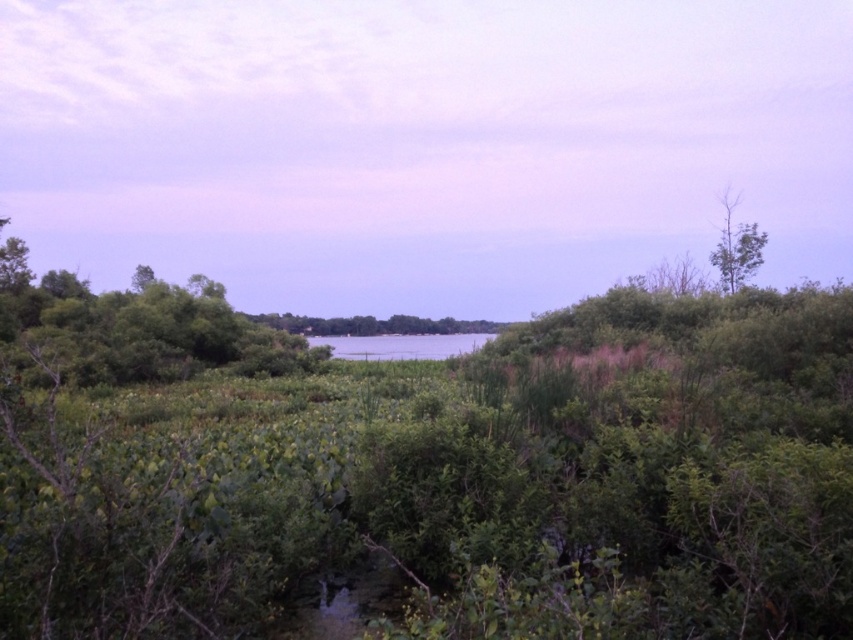
Question: Considering the relative positions of green leafy tree at center and green leafy tree at upper right in the image provided, where is green leafy tree at center located with respect to green leafy tree at upper right?

Choices:
 (A) right
 (B) left

Answer: (B)

Question: Can you confirm if green leafy tree at left is positioned to the left of green leafy tree at center?

Choices:
 (A) yes
 (B) no

Answer: (A)

Question: Can you confirm if green leafy tree at left is wider than green leafy tree at center?

Choices:
 (A) no
 (B) yes

Answer: (A)

Question: Which object is the closest to the green leafy tree at center?

Choices:
 (A) green leafy tree at left
 (B) green leafy tree at upper right

Answer: (A)

Question: Which point appears closest to the camera in this image?

Choices:
 (A) (47, 276)
 (B) (469, 323)
 (C) (722, 259)

Answer: (A)

Question: Among these points, which one is farthest from the camera?

Choices:
 (A) (244, 356)
 (B) (316, 321)

Answer: (B)